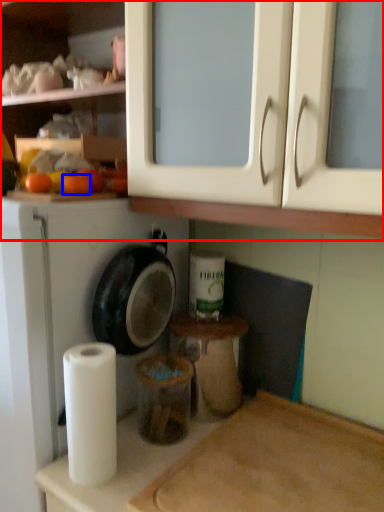
Question: Among these objects, which one is farthest to the camera, cabinetry (highlighted by a red box) or orange (highlighted by a blue box)?

Choices:
 (A) cabinetry
 (B) orange

Answer: (B)